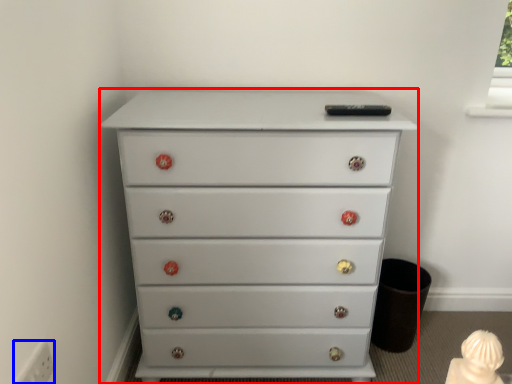
Question: Which object appears farthest to the camera in this image, chest of drawers (highlighted by a red box) or electric outlet (highlighted by a blue box)?

Choices:
 (A) chest of drawers
 (B) electric outlet

Answer: (A)